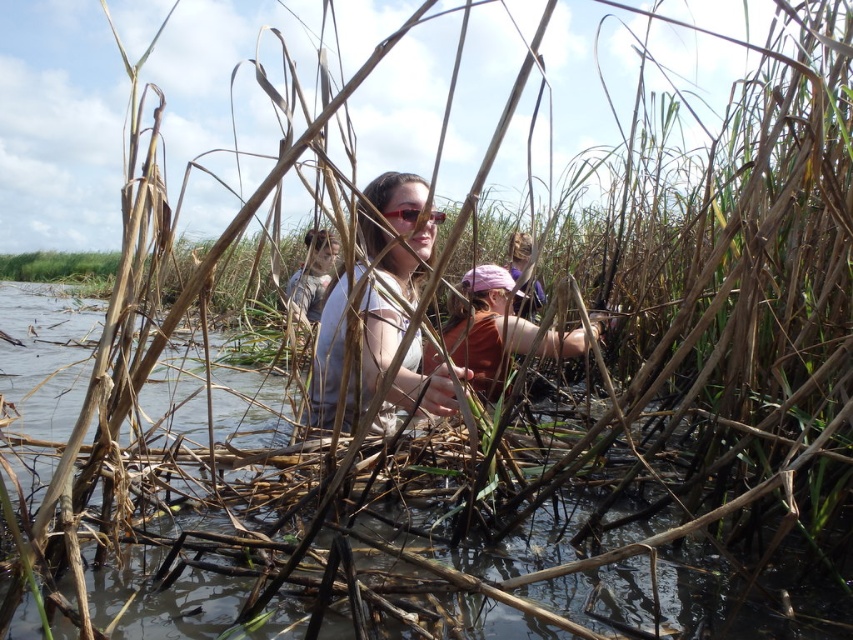
Question: Does matte orange shirt at center have a greater width compared to sunglasses at center?

Choices:
 (A) yes
 (B) no

Answer: (A)

Question: Does matte orange shirt at center have a lesser width compared to sunglasses at center?

Choices:
 (A) yes
 (B) no

Answer: (B)

Question: Is matte orange shirt at center thinner than sunglasses at center?

Choices:
 (A) yes
 (B) no

Answer: (B)

Question: Among these points, which one is nearest to the camera?

Choices:
 (A) (390, 412)
 (B) (436, 212)
 (C) (514, 321)

Answer: (A)

Question: Among these objects, which one is farthest from the camera?

Choices:
 (A) matte white shirt at center
 (B) matte orange shirt at center
 (C) sunglasses at center

Answer: (B)

Question: Among these points, which one is farthest from the camera?

Choices:
 (A) (428, 388)
 (B) (448, 353)

Answer: (B)